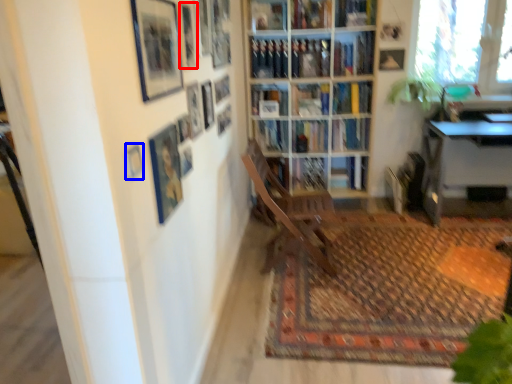
Question: Among these objects, which one is nearest to the camera, picture frame (highlighted by a red box) or picture frame (highlighted by a blue box)?

Choices:
 (A) picture frame
 (B) picture frame

Answer: (B)